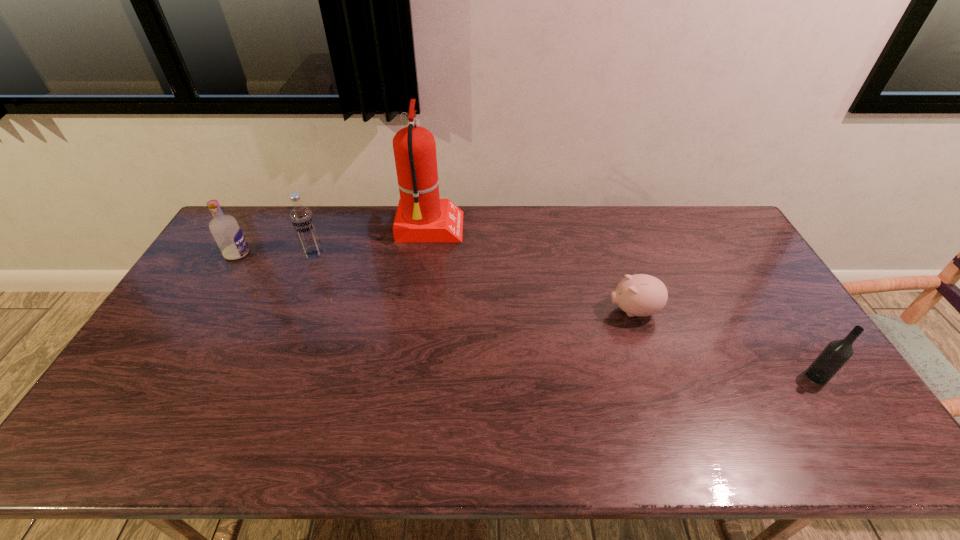
Where is `vacant space that satisfies the following two spatial constraints: 1. on the front label of the second vodka from right to left; 2. on the left side of the nearest vodka`? Image resolution: width=960 pixels, height=540 pixels. vacant space that satisfies the following two spatial constraints: 1. on the front label of the second vodka from right to left; 2. on the left side of the nearest vodka is located at coordinates (262, 376).

This screenshot has width=960, height=540. I want to click on vacant region that satisfies the following two spatial constraints: 1. on the label of the rightmost object; 2. on the left side of the leftmost object, so click(163, 376).

This screenshot has height=540, width=960. Identify the location of free space in the image that satisfies the following two spatial constraints: 1. on the front label of the rightmost object; 2. on the left side of the second object from left to right. (262, 376).

Image resolution: width=960 pixels, height=540 pixels. Identify the location of free spot that satisfies the following two spatial constraints: 1. on the back side of the nearest object; 2. at the snout of the second nearest object. (775, 310).

Find the location of `free space that satisfies the following two spatial constraints: 1. at the snout of the rightmost vodka; 2. on the left side of the piggy bank`. free space that satisfies the following two spatial constraints: 1. at the snout of the rightmost vodka; 2. on the left side of the piggy bank is located at coordinates (656, 376).

Image resolution: width=960 pixels, height=540 pixels. I want to click on vacant region that satisfies the following two spatial constraints: 1. on the label of the leftmost object; 2. on the back side of the rightmost vodka, so click(163, 376).

Image resolution: width=960 pixels, height=540 pixels. I want to click on free spot that satisfies the following two spatial constraints: 1. on the front label of the nearest vodka; 2. on the left side of the second vodka from right to left, so click(262, 376).

Find the location of a particular element. Image resolution: width=960 pixels, height=540 pixels. free space that satisfies the following two spatial constraints: 1. on the label of the rightmost vodka; 2. on the left side of the leftmost object is located at coordinates (163, 376).